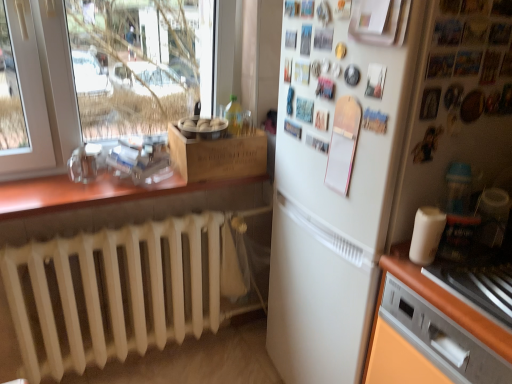
Question: Is metallic silver dishwasher at lower right outside of white matte cup at right?

Choices:
 (A) no
 (B) yes

Answer: (B)

Question: From the image's perspective, would you say metallic silver dishwasher at lower right is positioned over white matte cup at right?

Choices:
 (A) yes
 (B) no

Answer: (B)

Question: Considering the relative sizes of metallic silver dishwasher at lower right and white matte cup at right in the image provided, is metallic silver dishwasher at lower right wider than white matte cup at right?

Choices:
 (A) no
 (B) yes

Answer: (B)

Question: Is metallic silver dishwasher at lower right thinner than white matte cup at right?

Choices:
 (A) yes
 (B) no

Answer: (B)

Question: From the image's perspective, is metallic silver dishwasher at lower right under white matte cup at right?

Choices:
 (A) no
 (B) yes

Answer: (B)

Question: Considering the positions of metallic silver dishwasher at lower right and wooden crate at center in the image, is metallic silver dishwasher at lower right wider or thinner than wooden crate at center?

Choices:
 (A) thin
 (B) wide

Answer: (B)

Question: From a real-world perspective, is metallic silver dishwasher at lower right positioned above or below wooden crate at center?

Choices:
 (A) above
 (B) below

Answer: (B)

Question: In the image, is metallic silver dishwasher at lower right on the left side or the right side of wooden crate at center?

Choices:
 (A) left
 (B) right

Answer: (B)

Question: From the image's perspective, is metallic silver dishwasher at lower right located above or below wooden crate at center?

Choices:
 (A) below
 (B) above

Answer: (A)

Question: In the image, is metallic silver dishwasher at lower right on the left side or the right side of white matte refrigerator at center?

Choices:
 (A) left
 (B) right

Answer: (B)

Question: Is point (484, 357) positioned closer to the camera than point (350, 226)?

Choices:
 (A) closer
 (B) farther

Answer: (A)

Question: Is metallic silver dishwasher at lower right bigger or smaller than white matte refrigerator at center?

Choices:
 (A) small
 (B) big

Answer: (A)

Question: Is metallic silver dishwasher at lower right wider or thinner than white matte refrigerator at center?

Choices:
 (A) thin
 (B) wide

Answer: (A)

Question: Looking at the image, does white matte refrigerator at center seem bigger or smaller compared to white matte cup at right?

Choices:
 (A) big
 (B) small

Answer: (A)

Question: Is white matte refrigerator at center inside or outside of white matte cup at right?

Choices:
 (A) outside
 (B) inside

Answer: (A)